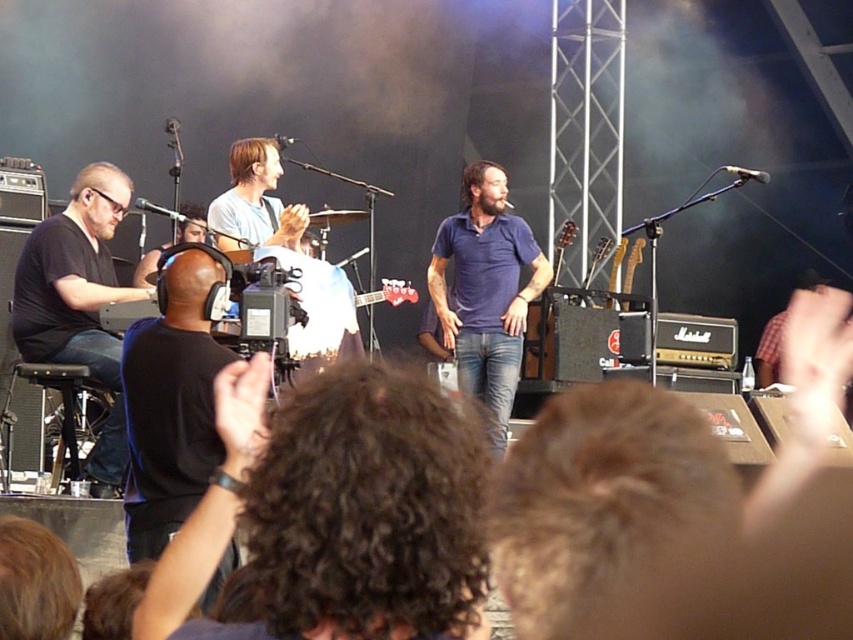
Who is positioned more to the left, black matte headphones at left or blue cotton shirt at center?

From the viewer's perspective, black matte headphones at left appears more on the left side.

Which is behind, point (38, 355) or point (461, 188)?

Point (461, 188)

The height and width of the screenshot is (640, 853). What do you see at coordinates (79, 304) in the screenshot?
I see `black matte headphones at left` at bounding box center [79, 304].

Where is `black matte headphones at left`? The width and height of the screenshot is (853, 640). black matte headphones at left is located at coordinates (79, 304).

Who is lower down, dark curly hair at lower center or black matte headphones at left?

Positioned lower is dark curly hair at lower center.

This screenshot has width=853, height=640. I want to click on dark curly hair at lower center, so click(335, 512).

Between point (387, 612) and point (105, 182), which one is positioned behind?

The point (105, 182) is behind.

I want to click on dark curly hair at lower center, so click(335, 512).

Between point (442, 563) and point (527, 284), which one is positioned behind?

Positioned behind is point (527, 284).

Who is positioned more to the right, dark curly hair at lower center or blue cotton shirt at center?

blue cotton shirt at center

Between point (189, 580) and point (517, 328), which one is positioned behind?

Point (517, 328)

The height and width of the screenshot is (640, 853). I want to click on dark curly hair at lower center, so click(335, 512).